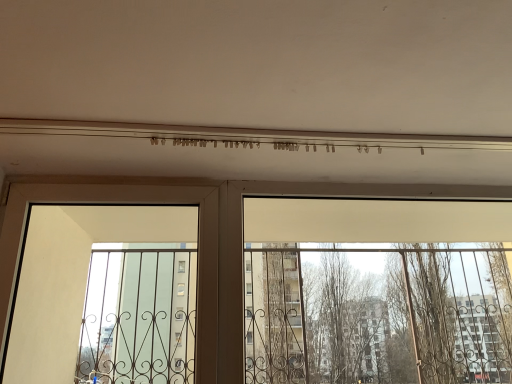
Image resolution: width=512 pixels, height=384 pixels. Describe the element at coordinates (378, 313) in the screenshot. I see `white matte curtain at upper center` at that location.

In order to click on white matte curtain at upper center in this screenshot , I will do click(x=378, y=313).

Where is `white matte curtain at upper center`? The image size is (512, 384). white matte curtain at upper center is located at coordinates (378, 313).